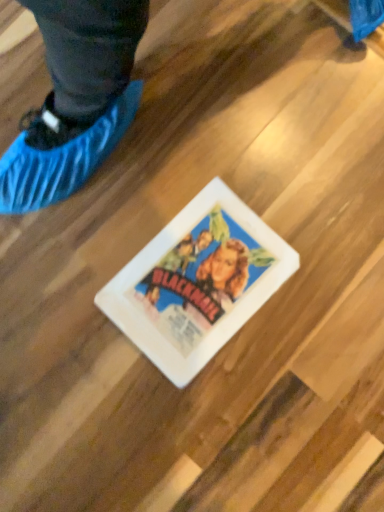
The image size is (384, 512). I want to click on vacant space in white glossy book cover at center (from a real-world perspective), so click(x=201, y=279).